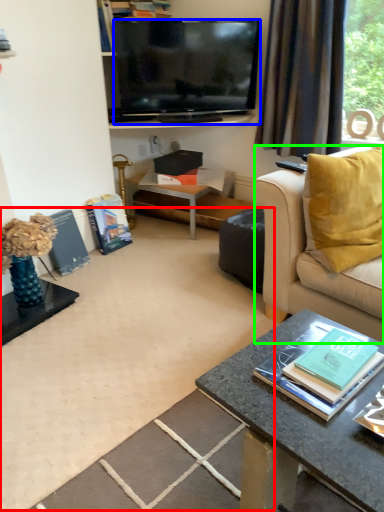
Question: Estimate the real-world distances between objects in this image. Which object is closer to plain (highlighted by a red box), television (highlighted by a blue box) or studio couch (highlighted by a green box)?

Choices:
 (A) television
 (B) studio couch

Answer: (B)